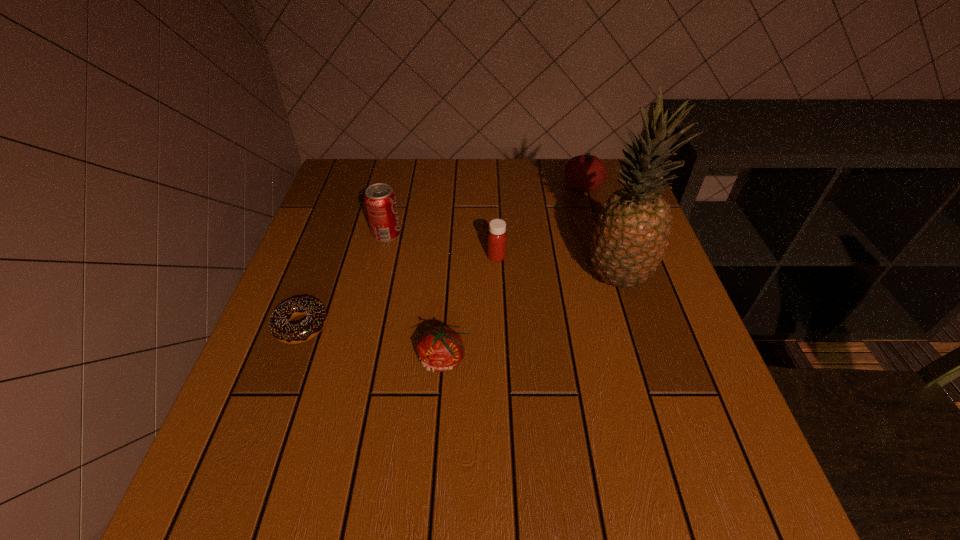
I want to click on vacant point that satisfies the following two spatial constraints: 1. on the back side of the doughnut; 2. on the right side of the farthest object, so click(x=352, y=187).

Identify the location of free space that satisfies the following two spatial constraints: 1. on the back side of the taller tomato; 2. on the right side of the second farthest object. (397, 187).